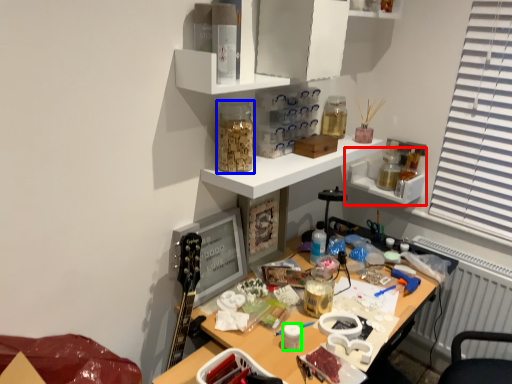
Question: Considering the real-world distances, which object is farthest from shelf (highlighted by a red box)? stationery (highlighted by a blue box) or stationery (highlighted by a green box)?

Choices:
 (A) stationery
 (B) stationery

Answer: (B)